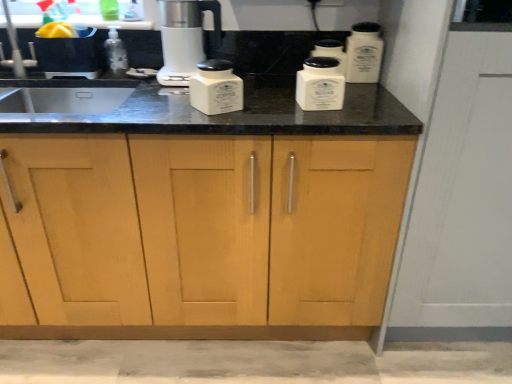
Question: From a real-world perspective, is white ceramic container at upper right, which ranks as the 4th kitchen appliance in left-to-right order, positioned above or below white ceramic container at center, the 3th kitchen appliance from the right?

Choices:
 (A) below
 (B) above

Answer: (B)

Question: In the image, is white ceramic container at upper right, which ranks as the 4th kitchen appliance in left-to-right order, positioned in front of or behind white ceramic container at center, the 3th kitchen appliance from the right?

Choices:
 (A) behind
 (B) front

Answer: (A)

Question: Considering the real-world distances, which object is farthest from the white ceramic container at upper right, which ranks as the 4th kitchen appliance in left-to-right order?

Choices:
 (A) white ceramic container at center, positioned as the first kitchen appliance in left-to-right order
 (B) white ceramic sugar container at upper center, which is counted as the third kitchen appliance, starting from the left
 (C) light wood cabinet at center
 (D) transparent plastic bottle at left
 (E) white ceramic container at center, which is the second kitchen appliance from left to right

Answer: (D)

Question: Which object is the closest to the light wood cabinet at center?

Choices:
 (A) white ceramic container at center, which is the second kitchen appliance from left to right
 (B) white ceramic container at upper right, the 1th kitchen appliance positioned from the right
 (C) transparent plastic bottle at left
 (D) white ceramic container at center, which is the 4th kitchen appliance from right to left
 (E) satin white coffee maker at center

Answer: (D)